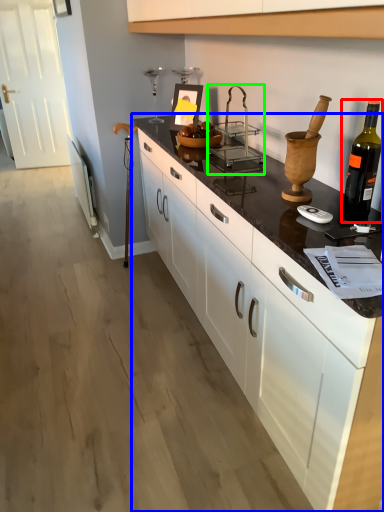
Question: Which object is positioned farthest from bottle (highlighted by a red box)? Select from countertop (highlighted by a blue box) and appliance (highlighted by a green box).

Choices:
 (A) countertop
 (B) appliance

Answer: (B)